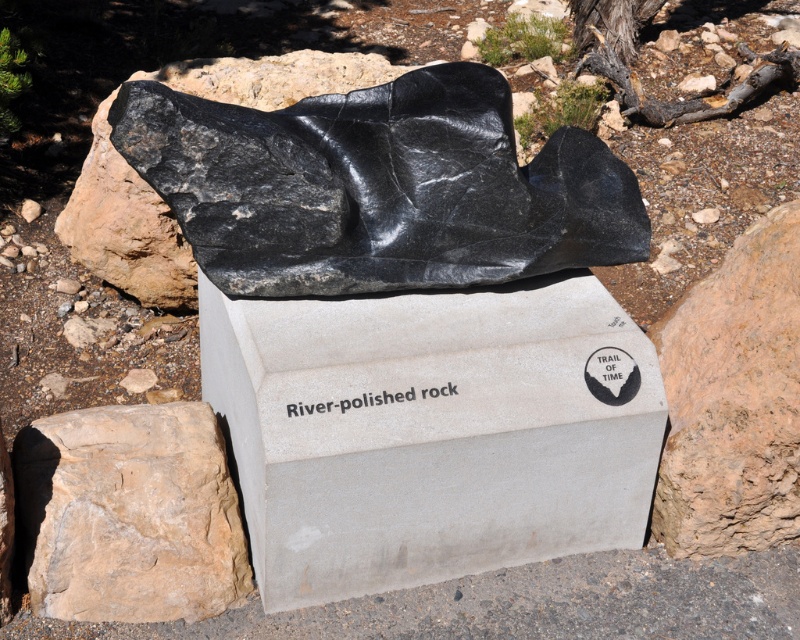
Question: Does black polished rock at center have a lesser width compared to brown rough rock at lower right?

Choices:
 (A) no
 (B) yes

Answer: (A)

Question: Considering the relative positions of beige rough rock at lower left and blackmaterial/textureriver-polished rock at center in the image provided, where is beige rough rock at lower left located with respect to blackmaterial/textureriver-polished rock at center?

Choices:
 (A) right
 (B) left

Answer: (B)

Question: Which object is positioned closest to the blackmaterial/textureriver-polished rock at center?

Choices:
 (A) gray concrete plaque at center
 (B) beige rough rock at lower left

Answer: (A)

Question: Is brown rough rock at lower right below blackmaterial/textureriver-polished rock at center?

Choices:
 (A) no
 (B) yes

Answer: (A)

Question: Which object is closer to the camera taking this photo?

Choices:
 (A) brown rough rock at lower right
 (B) black polished rock at center

Answer: (B)

Question: Estimate the real-world distances between objects in this image. Which object is closer to the brown rough rock at lower right?

Choices:
 (A) beige rough rock at lower left
 (B) blackmaterial/textureriver-polished rock at center
 (C) black polished rock at center

Answer: (C)